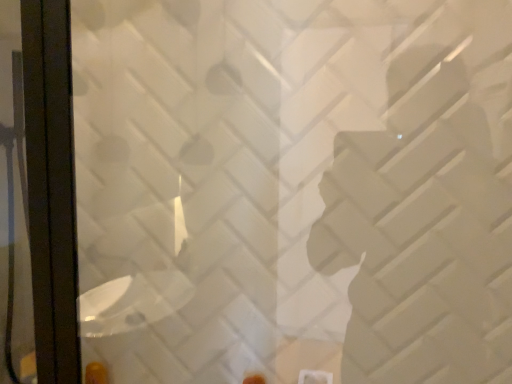
You are a GUI agent. You are given a task and a screenshot of the screen. Output one action in this format:
    pyautogui.click(x=<x>, y=<y>)
    Task: Click on the black matte screen door at left
    The width and height of the screenshot is (512, 384).
    Given the screenshot: What is the action you would take?
    pyautogui.click(x=37, y=192)

Describe the element at coordinates (37, 192) in the screenshot. This screenshot has width=512, height=384. I see `black matte screen door at left` at that location.

This screenshot has width=512, height=384. Find the location of `black matte screen door at left`. black matte screen door at left is located at coordinates (37, 192).